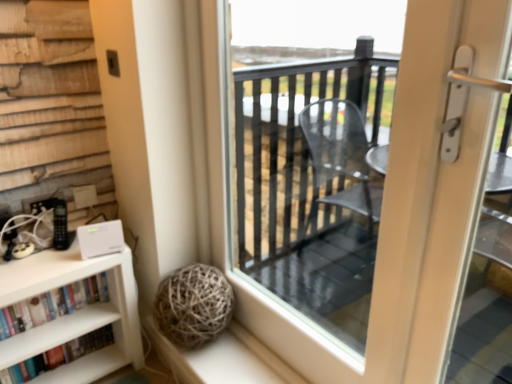
The height and width of the screenshot is (384, 512). What do you see at coordinates (52, 305) in the screenshot? I see `white matte bookshelf at lower left, positioned as the 1th book in top-to-bottom order` at bounding box center [52, 305].

At what (x,y) coordinates should I click in order to perform the action: click on hardcover books at lower left, placed as the second book when sorted from top to bottom. Please return your answer as a coordinate pair (x, y). Looking at the image, I should click on (58, 356).

Considering the relative sizes of white matte bookshelf at lower left, positioned as the second book in bottom-to-top order, and hardcover books at lower left, which ranks as the first book in bottom-to-top order, in the image provided, is white matte bookshelf at lower left, positioned as the second book in bottom-to-top order, smaller than hardcover books at lower left, which ranks as the first book in bottom-to-top order,?

Actually, white matte bookshelf at lower left, positioned as the second book in bottom-to-top order, might be larger than hardcover books at lower left, which ranks as the first book in bottom-to-top order.

Looking at their sizes, would you say white matte bookshelf at lower left, positioned as the second book in bottom-to-top order, is wider or thinner than hardcover books at lower left, placed as the second book when sorted from top to bottom?

Clearly, white matte bookshelf at lower left, positioned as the second book in bottom-to-top order, has more width compared to hardcover books at lower left, placed as the second book when sorted from top to bottom.

Which object is positioned more to the right, white matte bookshelf at lower left, positioned as the second book in bottom-to-top order, or hardcover books at lower left, placed as the second book when sorted from top to bottom?

white matte bookshelf at lower left, positioned as the second book in bottom-to-top order.

Are white matte bookshelf at lower left, positioned as the second book in bottom-to-top order, and hardcover books at lower left, placed as the second book when sorted from top to bottom, located far from each other?

Actually, white matte bookshelf at lower left, positioned as the second book in bottom-to-top order, and hardcover books at lower left, placed as the second book when sorted from top to bottom, are a little close together.

Is the surface of transparent glass door at center in direct contact with white matte bookshelf at lower left, positioned as the second book in bottom-to-top order?

No, transparent glass door at center is not making contact with white matte bookshelf at lower left, positioned as the second book in bottom-to-top order.

There is a white matte bookshelf at lower left, positioned as the 1th book in top-to-bottom order. What are the coordinates of `screen door above it (from a real-world perspective)` in the screenshot? It's located at (384, 220).

Can you confirm if transparent glass door at center is positioned to the right of white matte bookshelf at lower left, positioned as the second book in bottom-to-top order?

Indeed, transparent glass door at center is positioned on the right side of white matte bookshelf at lower left, positioned as the second book in bottom-to-top order.

Looking at this image, which of these two, transparent glass door at center or white matte bookshelf at lower left, positioned as the second book in bottom-to-top order, is thinner?

transparent glass door at center.

Between transparent glass door at center and hardcover books at lower left, placed as the second book when sorted from top to bottom, which one appears on the left side from the viewer's perspective?

From the viewer's perspective, hardcover books at lower left, placed as the second book when sorted from top to bottom, appears more on the left side.

Identify the location of screen door on the right of hardcover books at lower left, which ranks as the first book in bottom-to-top order. The width and height of the screenshot is (512, 384). (384, 220).

Is transparent glass door at center completely or partially outside of hardcover books at lower left, placed as the second book when sorted from top to bottom?

Yes, transparent glass door at center is outside of hardcover books at lower left, placed as the second book when sorted from top to bottom.

Is transparent glass door at center oriented towards hardcover books at lower left, placed as the second book when sorted from top to bottom?

No, transparent glass door at center is not oriented towards hardcover books at lower left, placed as the second book when sorted from top to bottom.

Could you tell me if hardcover books at lower left, which ranks as the first book in bottom-to-top order, is facing transparent glass door at center?

No, hardcover books at lower left, which ranks as the first book in bottom-to-top order, does not turn towards transparent glass door at center.

Is transparent glass door at center completely or partially inside hardcover books at lower left, placed as the second book when sorted from top to bottom?

Definitely not — transparent glass door at center is not inside hardcover books at lower left, placed as the second book when sorted from top to bottom.

You are a GUI agent. You are given a task and a screenshot of the screen. Output one action in this format:
    pyautogui.click(x=<x>, y=<y>)
    Task: Click on the screen door lying on the right of hardcover books at lower left, which ranks as the first book in bottom-to-top order
    The image size is (512, 384).
    Given the screenshot: What is the action you would take?
    pyautogui.click(x=384, y=220)

Is white matte bookshelf at lower left, positioned as the 1th book in top-to-bottom order, closer to camera compared to transparent glass door at center?

No, it is behind transparent glass door at center.

Considering the relative sizes of white matte bookshelf at lower left, positioned as the 1th book in top-to-bottom order, and transparent glass door at center in the image provided, is white matte bookshelf at lower left, positioned as the 1th book in top-to-bottom order, thinner than transparent glass door at center?

No, white matte bookshelf at lower left, positioned as the 1th book in top-to-bottom order, is not thinner than transparent glass door at center.

Is white matte bookshelf at lower left, positioned as the 1th book in top-to-bottom order, not within transparent glass door at center?

That's correct, white matte bookshelf at lower left, positioned as the 1th book in top-to-bottom order, is outside of transparent glass door at center.

Considering the sizes of objects white matte bookshelf at lower left, positioned as the 1th book in top-to-bottom order, and transparent glass door at center in the image provided, who is bigger, white matte bookshelf at lower left, positioned as the 1th book in top-to-bottom order, or transparent glass door at center?

Bigger between the two is transparent glass door at center.

Considering the sizes of hardcover books at lower left, placed as the second book when sorted from top to bottom, and white matte bookshelf at lower left, positioned as the 1th book in top-to-bottom order, in the image, is hardcover books at lower left, placed as the second book when sorted from top to bottom, bigger or smaller than white matte bookshelf at lower left, positioned as the 1th book in top-to-bottom order,?

Clearly, hardcover books at lower left, placed as the second book when sorted from top to bottom, is smaller in size than white matte bookshelf at lower left, positioned as the 1th book in top-to-bottom order.

From a real-world perspective, is hardcover books at lower left, placed as the second book when sorted from top to bottom, beneath white matte bookshelf at lower left, positioned as the 1th book in top-to-bottom order?

Correct, in the physical world, hardcover books at lower left, placed as the second book when sorted from top to bottom, is lower than white matte bookshelf at lower left, positioned as the 1th book in top-to-bottom order.

Does hardcover books at lower left, placed as the second book when sorted from top to bottom, touch white matte bookshelf at lower left, positioned as the 1th book in top-to-bottom order?

No, hardcover books at lower left, placed as the second book when sorted from top to bottom, is not making contact with white matte bookshelf at lower left, positioned as the 1th book in top-to-bottom order.

Considering the positions of objects hardcover books at lower left, which ranks as the first book in bottom-to-top order, and white matte bookshelf at lower left, positioned as the 1th book in top-to-bottom order, in the image provided, who is in front, hardcover books at lower left, which ranks as the first book in bottom-to-top order, or white matte bookshelf at lower left, positioned as the 1th book in top-to-bottom order,?

Positioned in front is white matte bookshelf at lower left, positioned as the 1th book in top-to-bottom order.

The image size is (512, 384). I want to click on book located above the hardcover books at lower left, which ranks as the first book in bottom-to-top order (from the image's perspective), so pos(52,305).

Find the location of a particular element. the 1st book located beneath the transparent glass door at center (from a real-world perspective) is located at coordinates (52, 305).

From the image, which object appears to be farther from white matte bookshelf at lower left, positioned as the 1th book in top-to-bottom order, transparent glass door at center or hardcover books at lower left, which ranks as the first book in bottom-to-top order?

transparent glass door at center is positioned further to the anchor white matte bookshelf at lower left, positioned as the 1th book in top-to-bottom order.

Considering their positions, is hardcover books at lower left, which ranks as the first book in bottom-to-top order, positioned further to transparent glass door at center than white matte bookshelf at lower left, positioned as the second book in bottom-to-top order?

hardcover books at lower left, which ranks as the first book in bottom-to-top order, lies further to transparent glass door at center than the other object.

Which object lies nearer to the anchor point transparent glass door at center, white matte bookshelf at lower left, positioned as the 1th book in top-to-bottom order, or hardcover books at lower left, placed as the second book when sorted from top to bottom?

Based on the image, white matte bookshelf at lower left, positioned as the 1th book in top-to-bottom order, appears to be nearer to transparent glass door at center.

From the image, which object appears to be farther from white matte bookshelf at lower left, positioned as the 1th book in top-to-bottom order, hardcover books at lower left, placed as the second book when sorted from top to bottom, or transparent glass door at center?

transparent glass door at center is further to white matte bookshelf at lower left, positioned as the 1th book in top-to-bottom order.

Based on their spatial positions, is white matte bookshelf at lower left, positioned as the second book in bottom-to-top order, or transparent glass door at center further from hardcover books at lower left, which ranks as the first book in bottom-to-top order?

transparent glass door at center.

When comparing their distances from hardcover books at lower left, which ranks as the first book in bottom-to-top order, does transparent glass door at center or white matte bookshelf at lower left, positioned as the 1th book in top-to-bottom order, seem closer?

white matte bookshelf at lower left, positioned as the 1th book in top-to-bottom order.

At what (x,y) coordinates should I click in order to perform the action: click on book situated between hardcover books at lower left, which ranks as the first book in bottom-to-top order, and transparent glass door at center from left to right. Please return your answer as a coordinate pair (x, y). Looking at the image, I should click on (52, 305).